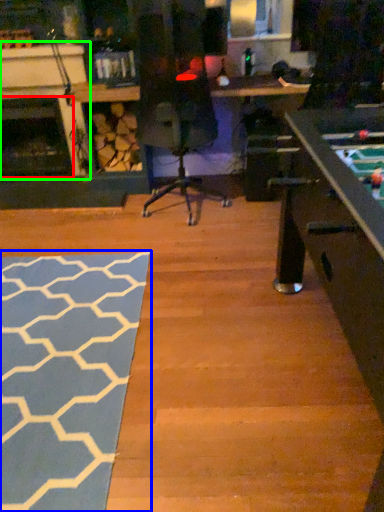
Question: Which object is positioned farthest from fireplace (highlighted by a red box)? Select from mat (highlighted by a blue box) and fireplace (highlighted by a green box).

Choices:
 (A) mat
 (B) fireplace

Answer: (A)